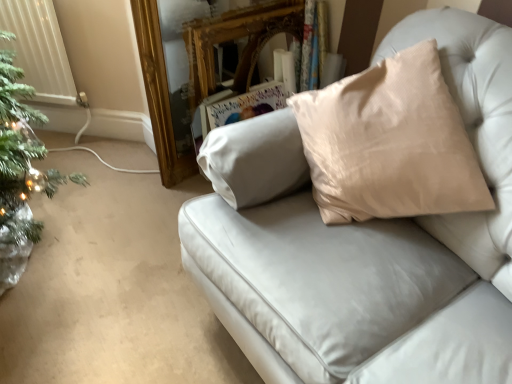
Question: Would you say satin beige pillow at upper right is to the left or to the right of gold ornate mirror at upper center in the picture?

Choices:
 (A) right
 (B) left

Answer: (A)

Question: From the image's perspective, relative to gold ornate mirror at upper center, is satin beige pillow at upper right above or below?

Choices:
 (A) above
 (B) below

Answer: (B)

Question: Which of these objects is positioned closest to the gold ornate mirror at upper center?

Choices:
 (A) satin beige pillow at upper right
 (B) white plastic radiator at left

Answer: (B)

Question: Which of these objects is positioned closest to the satin beige pillow at upper right?

Choices:
 (A) white plastic radiator at left
 (B) gold ornate mirror at upper center

Answer: (B)